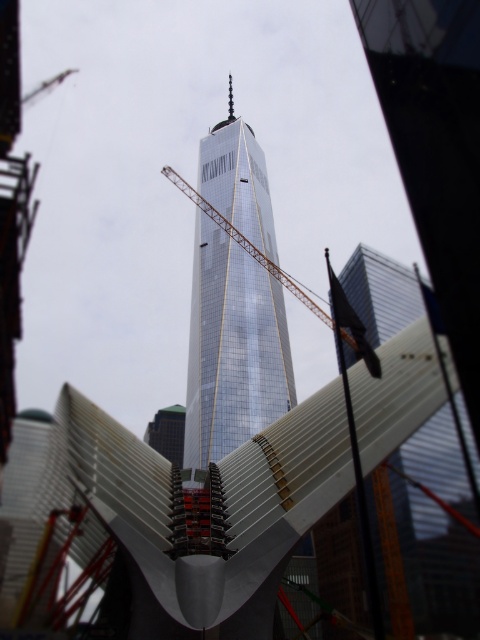
Question: Where is shiny glass skyscraper at center located in relation to metallic gold crane at center in the image?

Choices:
 (A) below
 (B) above

Answer: (B)

Question: Does shiny glass skyscraper at center appear on the right side of metallic gold crane at center?

Choices:
 (A) no
 (B) yes

Answer: (A)

Question: Is shiny glass skyscraper at center above metallic gold crane at center?

Choices:
 (A) no
 (B) yes

Answer: (B)

Question: Which object is farther from the camera taking this photo?

Choices:
 (A) metallic gold crane at center
 (B) shiny glass skyscraper at center

Answer: (B)

Question: Which point is farther from the camera taking this photo?

Choices:
 (A) (267, 269)
 (B) (216, 310)

Answer: (A)